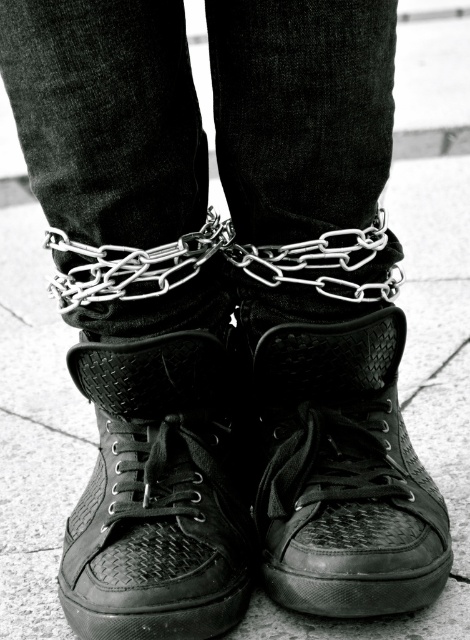
Is black woven fabric shoe at center above matte black sneaker at center?

No, black woven fabric shoe at center is not above matte black sneaker at center.

Which of these two, black woven fabric shoe at center or matte black sneaker at center, stands taller?

matte black sneaker at center

Which is in front, point (243, 520) or point (271, 588)?

Point (271, 588) is in front.

Image resolution: width=470 pixels, height=640 pixels. What are the coordinates of `black woven fabric shoe at center` in the screenshot? It's located at (159, 492).

Describe the element at coordinates (342, 468) in the screenshot. I see `matte black sneaker at center` at that location.

Between matte black sneaker at center and metallic chain at center, which one is positioned lower?

Positioned lower is matte black sneaker at center.

Locate an element on the screen. matte black sneaker at center is located at coordinates (342, 468).

Who is taller, black woven fabric shoe at center or metallic chain at center?

With more height is black woven fabric shoe at center.

Can you confirm if black woven fabric shoe at center is taller than metallic chain at center?

Yes, black woven fabric shoe at center is taller than metallic chain at center.

This screenshot has width=470, height=640. Describe the element at coordinates (159, 492) in the screenshot. I see `black woven fabric shoe at center` at that location.

You are a GUI agent. You are given a task and a screenshot of the screen. Output one action in this format:
    pyautogui.click(x=<x>, y=<y>)
    Task: Click on the black woven fabric shoe at center
    Image resolution: width=470 pixels, height=640 pixels.
    Given the screenshot: What is the action you would take?
    [x=159, y=492]